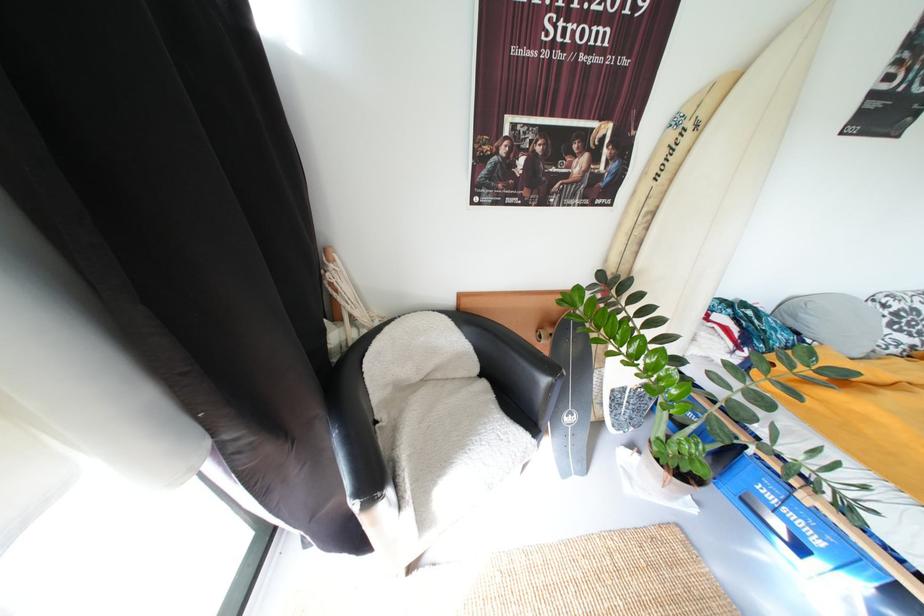
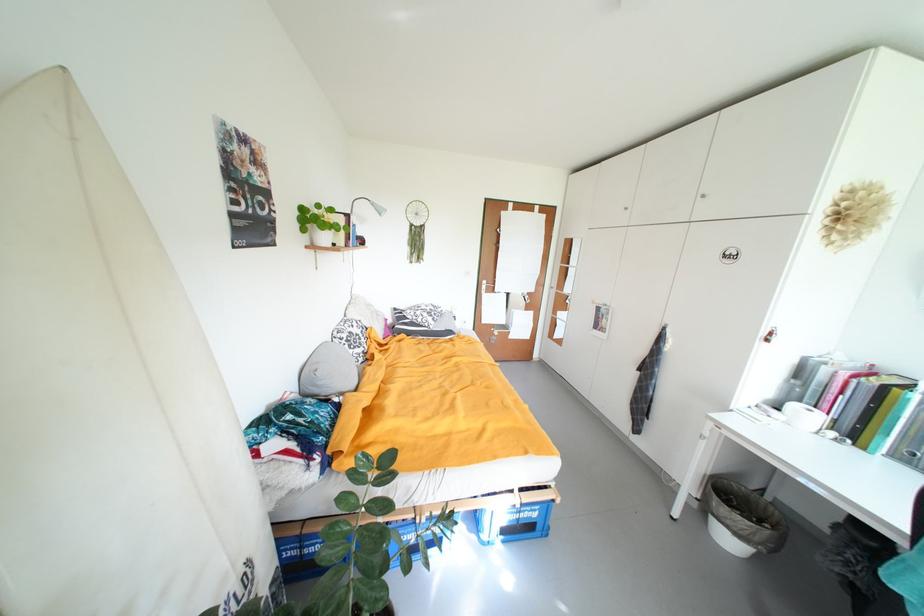
Find the pixel in the second image that matches the point at 809,317 in the first image.

(326, 385)